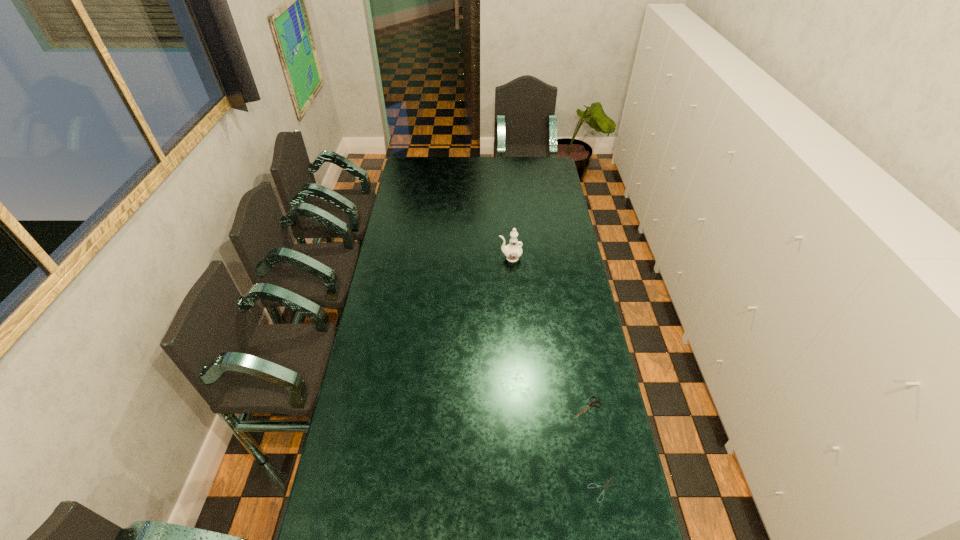
This screenshot has height=540, width=960. I want to click on the tallest object, so click(x=512, y=251).

Identify the location of the farthest object. (512, 251).

At what (x,y) coordinates should I click in order to perform the action: click on the second tallest object. Please return your answer as a coordinate pair (x, y). Looking at the image, I should click on (592, 403).

Locate an element on the screen. Image resolution: width=960 pixels, height=540 pixels. the second nearest object is located at coordinates (592, 403).

The width and height of the screenshot is (960, 540). Identify the location of the nearer shears. (597, 486).

At what (x,y) coordinates should I click in order to perform the action: click on the shortest object. Please return your answer as a coordinate pair (x, y). The image size is (960, 540). Looking at the image, I should click on (597, 486).

This screenshot has height=540, width=960. In order to click on free location located 0.320m at the spout of the farthest object in this screenshot , I will do `click(431, 258)`.

At what (x,y) coordinates should I click in order to perform the action: click on vacant space located 0.250m at the spout of the farthest object. Please return your answer as a coordinate pair (x, y). The width and height of the screenshot is (960, 540). Looking at the image, I should click on (445, 258).

I want to click on free space located 0.170m at the spout of the farthest object, so click(x=462, y=258).

I want to click on vacant region located on the front of the taller shears, so click(x=597, y=459).